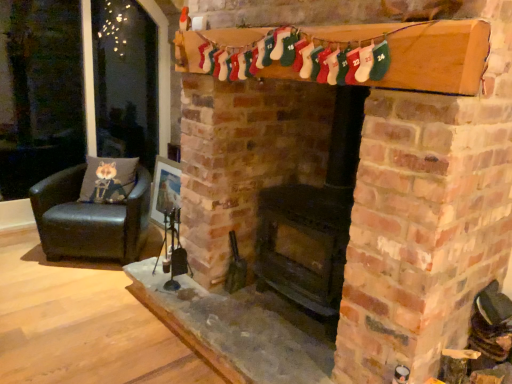
Question: Considering the positions of black matte fireplace at center and black leather chair at left in the image, is black matte fireplace at center wider or thinner than black leather chair at left?

Choices:
 (A) thin
 (B) wide

Answer: (A)

Question: Is black matte fireplace at center to the left or to the right of black leather chair at left in the image?

Choices:
 (A) right
 (B) left

Answer: (A)

Question: Which object is the closest to the black matte fireplace at center?

Choices:
 (A) gray fabric cushion at left
 (B) black leather chair at left

Answer: (B)

Question: Considering the real-world distances, which object is farthest from the black matte fireplace at center?

Choices:
 (A) black leather chair at left
 (B) gray fabric cushion at left

Answer: (B)